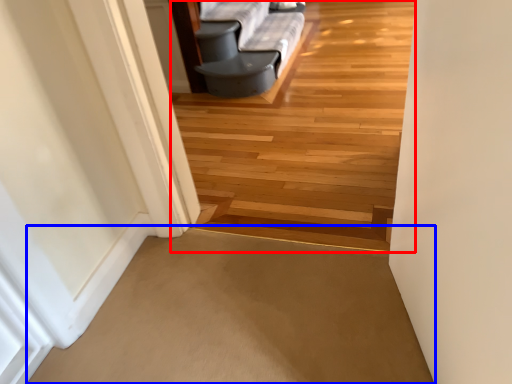
Question: Which object appears closest to the camera in this image, path (highlighted by a red box) or path (highlighted by a blue box)?

Choices:
 (A) path
 (B) path

Answer: (A)